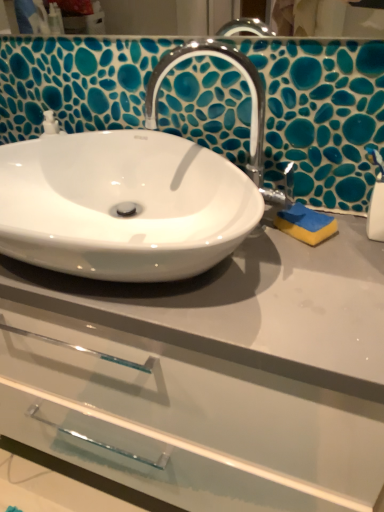
You are a GUI agent. You are given a task and a screenshot of the screen. Output one action in this format:
    pyautogui.click(x=<x>, y=<y>)
    Task: Click on the vacant area that lies between white glossy sink at center and white plastic soap dispenser at right
    
    Given the screenshot: What is the action you would take?
    pyautogui.click(x=312, y=275)